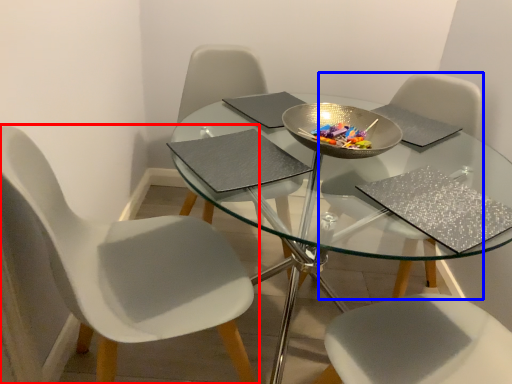
Question: Among these objects, which one is nearest to the camera, chair (highlighted by a red box) or chair (highlighted by a blue box)?

Choices:
 (A) chair
 (B) chair

Answer: (A)